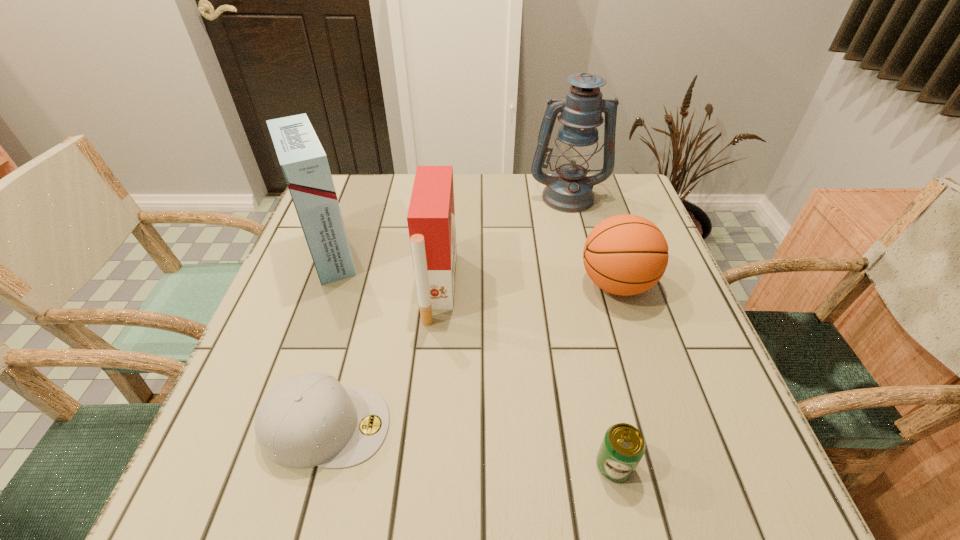
Image resolution: width=960 pixels, height=540 pixels. In order to click on object present at the near left corner in this screenshot , I will do `click(307, 420)`.

This screenshot has width=960, height=540. I want to click on object present at the far right corner, so click(569, 190).

This screenshot has width=960, height=540. What are the coordinates of `blank space at the far edge` in the screenshot? It's located at (495, 210).

Identify the location of free location at the near edge. tap(630, 497).

In the image, there is a desktop. Identify the location of blank space at the left edge. Image resolution: width=960 pixels, height=540 pixels. (310, 327).

Image resolution: width=960 pixels, height=540 pixels. In the image, there is a desktop. In order to click on free space at the right edge in this screenshot , I will do [x=664, y=318].

Find the location of a particular element. This screenshot has width=960, height=540. vacant position at the far left corner of the desktop is located at coordinates (370, 188).

Where is `vacant point located between the basketball and the beer can`? The height and width of the screenshot is (540, 960). vacant point located between the basketball and the beer can is located at coordinates (615, 375).

Locate an element on the screen. Image resolution: width=960 pixels, height=540 pixels. vacant space in between the beer can and the third shortest object is located at coordinates (615, 375).

Where is `vacant area that lies between the third shortest object and the fourth object from right to left`? vacant area that lies between the third shortest object and the fourth object from right to left is located at coordinates pyautogui.click(x=527, y=286).